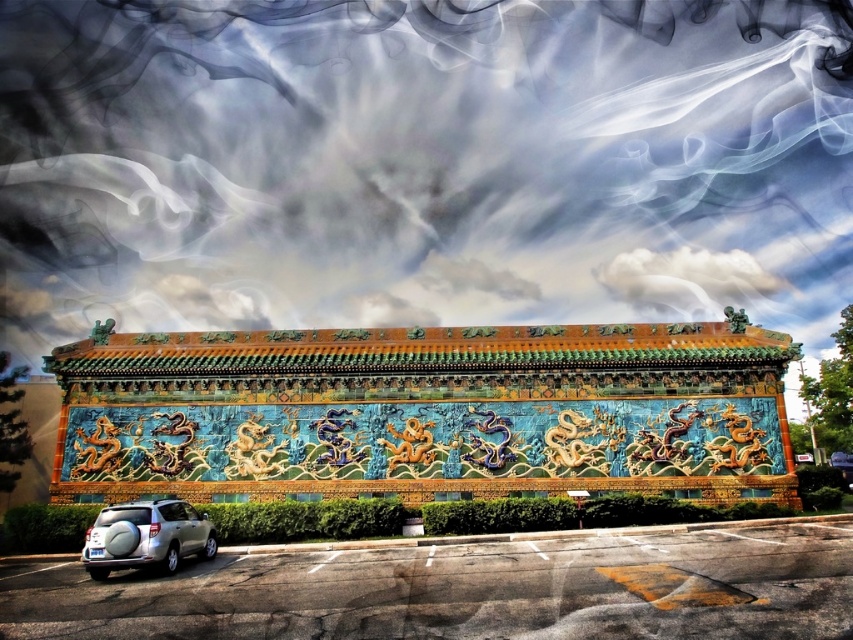
Which of these two, shiny ceramic wall at center or satin silver suv at lower left, stands taller?

shiny ceramic wall at center

Which is more to the left, shiny ceramic wall at center or satin silver suv at lower left?

Positioned to the left is satin silver suv at lower left.

Image resolution: width=853 pixels, height=640 pixels. I want to click on shiny ceramic wall at center, so click(425, 412).

Locate an element on the screen. This screenshot has width=853, height=640. shiny ceramic wall at center is located at coordinates (425, 412).